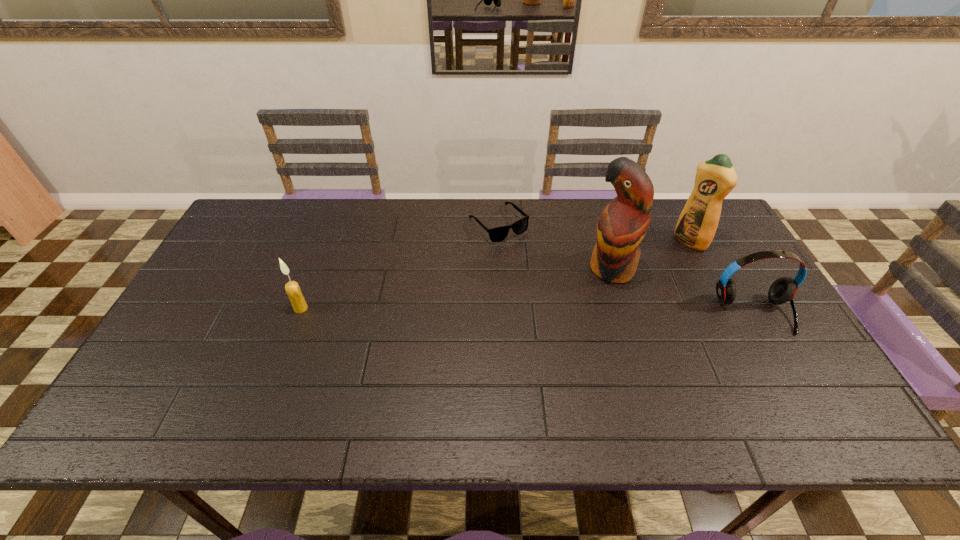
Image resolution: width=960 pixels, height=540 pixels. What are the coordinates of `free space located 0.240m on the face of the tallest object` in the screenshot? It's located at (540, 326).

Locate an element on the screen. Image resolution: width=960 pixels, height=540 pixels. vacant space located on the face of the tallest object is located at coordinates (565, 307).

Find the location of a particular element. vacant space situated 0.230m on the front-facing side of the fourth object from right to left is located at coordinates (557, 288).

Locate an element on the screen. This screenshot has width=960, height=540. vacant space located on the front-facing side of the fourth object from right to left is located at coordinates (539, 269).

Locate an element on the screen. This screenshot has height=540, width=960. free space located on the front-facing side of the fourth object from right to left is located at coordinates (587, 320).

At what (x,y) coordinates should I click in order to perform the action: click on free space located 0.230m on the label of the detergent. Please return your answer as a coordinate pair (x, y). The image size is (960, 540). Looking at the image, I should click on (636, 282).

The width and height of the screenshot is (960, 540). Find the location of `vacant space located 0.300m on the label of the detergent`. vacant space located 0.300m on the label of the detergent is located at coordinates (620, 293).

At what (x,y) coordinates should I click in order to perform the action: click on vacant area located on the label of the detergent. Please return your answer as a coordinate pair (x, y). The width and height of the screenshot is (960, 540). Looking at the image, I should click on (657, 267).

Where is `sunglasses situated at the far edge`? Image resolution: width=960 pixels, height=540 pixels. sunglasses situated at the far edge is located at coordinates (497, 234).

Find the location of a particular element. The width and height of the screenshot is (960, 540). detergent that is at the far edge is located at coordinates (715, 178).